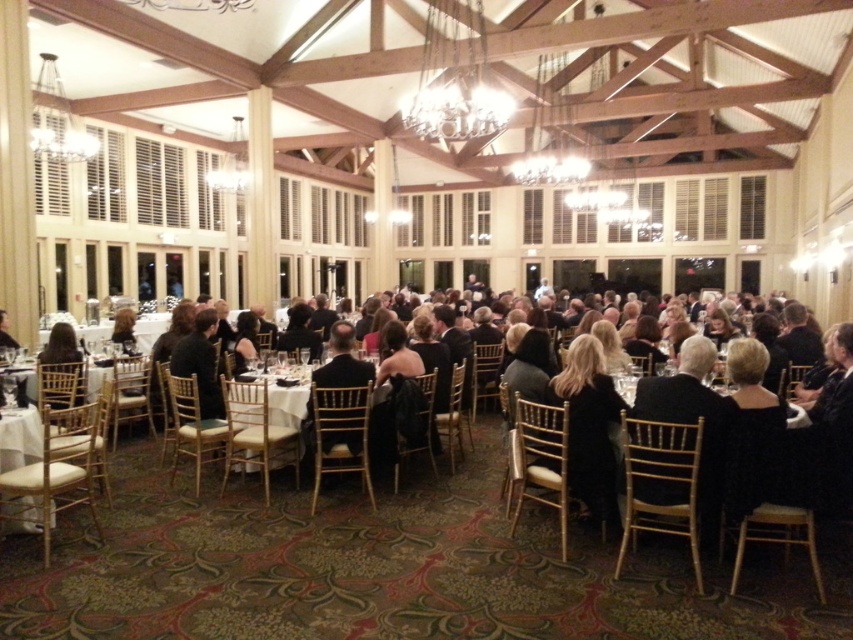
Question: Which point is closer to the camera?

Choices:
 (A) (260, 381)
 (B) (56, 376)
 (C) (346, 349)

Answer: (C)

Question: Among these objects, which one is farthest from the camera?

Choices:
 (A) dark brown hair at center
 (B) white cloth at center
 (C) black satin suit at center

Answer: (A)

Question: Can you confirm if black satin suit at center is positioned to the right of dark brown hair at center?

Choices:
 (A) yes
 (B) no

Answer: (A)

Question: Which of the following is the farthest from the observer?

Choices:
 (A) black satin suit at center
 (B) white cloth at center

Answer: (B)

Question: Does black satin suit at center lie behind white cloth at center?

Choices:
 (A) no
 (B) yes

Answer: (A)

Question: Is dark brown hair at center to the left of white cloth at center from the viewer's perspective?

Choices:
 (A) yes
 (B) no

Answer: (A)